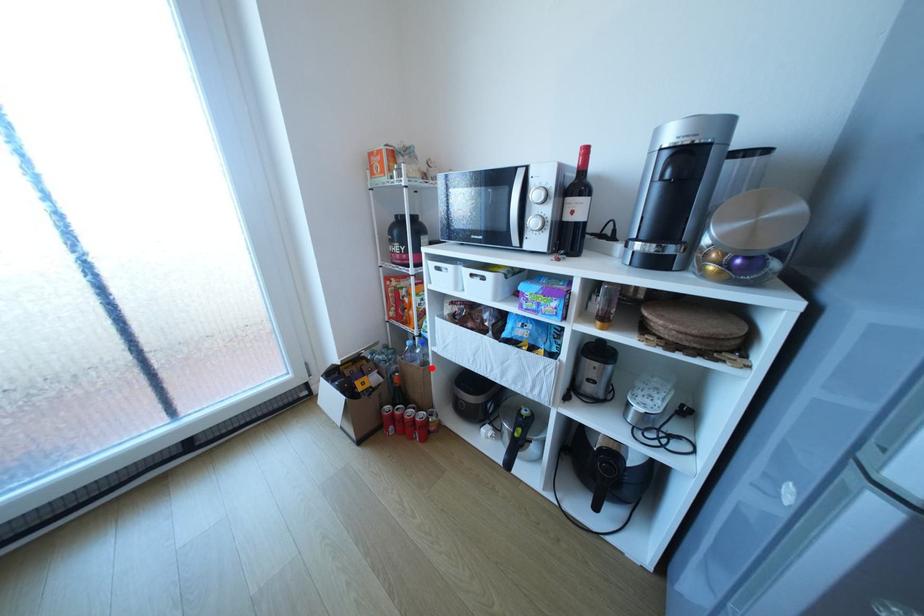
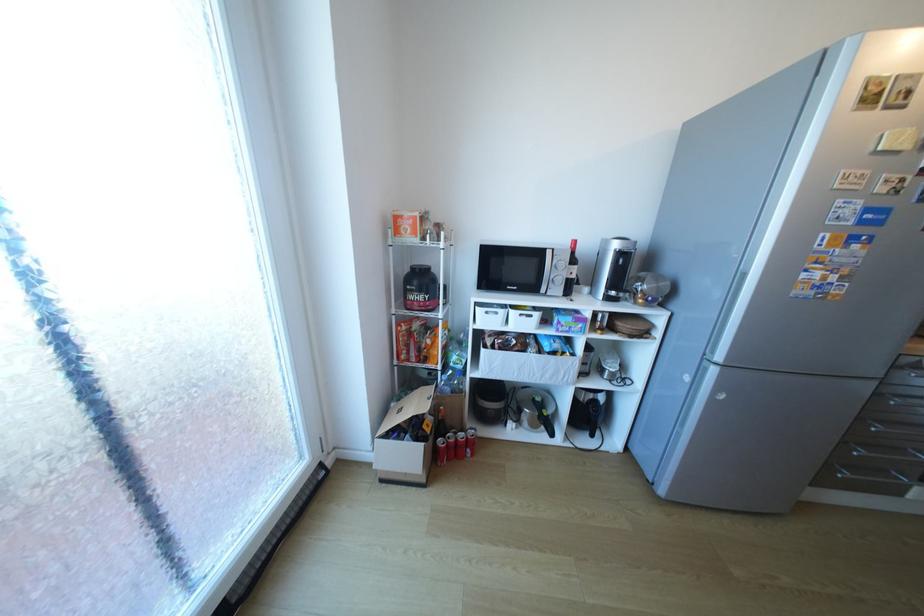
The point at the highlighted location is marked in the first image. Where is the corresponding point in the second image?

(472, 394)